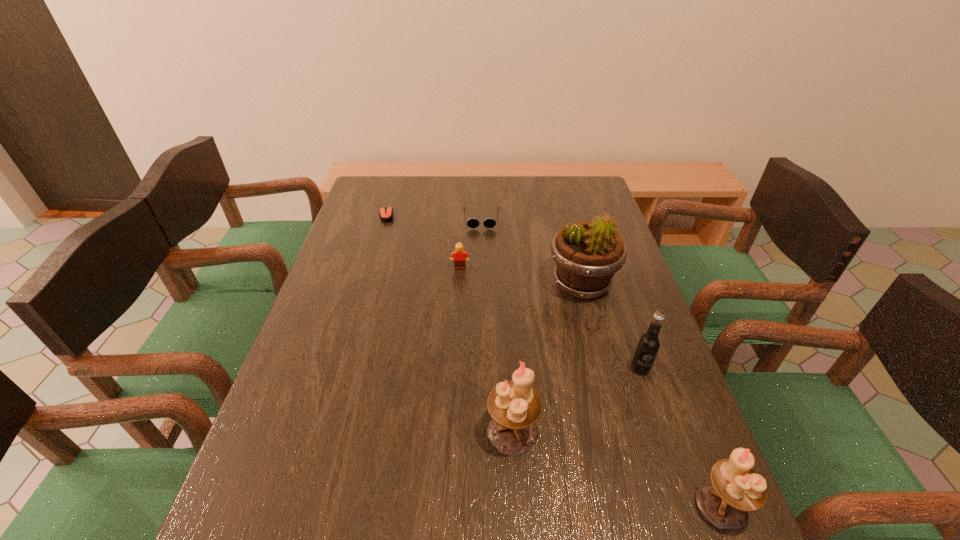
I want to click on vacant region between the sixth tallest object and the taller candle holder, so click(x=497, y=325).

Identify the location of empty space between the fifth farthest object and the computer mouse. (514, 292).

This screenshot has height=540, width=960. In order to click on empty space that is in between the fifth farthest object and the nearer candle holder in this screenshot , I will do [681, 437].

Find the location of a particular element. unoccupied position between the second nearest object and the computer mouse is located at coordinates (449, 324).

The height and width of the screenshot is (540, 960). I want to click on object that ranks as the fifth closest to the flowerpot, so click(x=735, y=488).

Locate an element on the screen. This screenshot has height=540, width=960. object that is the sixth closest one to the fifth farthest object is located at coordinates (386, 213).

This screenshot has height=540, width=960. What are the coordinates of `free location that satisfies the following two spatial constraints: 1. on the face of the Lego; 2. on the left side of the flowerpot` in the screenshot? It's located at (459, 284).

You are a GUI agent. You are given a task and a screenshot of the screen. Output one action in this format:
    pyautogui.click(x=<x>, y=<y>)
    Task: Click on the vacant position in the image that satisfies the following two spatial constraints: 1. on the front side of the flowerpot; 2. on the right side of the shortest object
    
    Given the screenshot: What is the action you would take?
    pyautogui.click(x=367, y=284)

This screenshot has width=960, height=540. I want to click on vacant point that satisfies the following two spatial constraints: 1. on the front side of the right candle holder; 2. on the left side of the flowerpot, so click(x=639, y=505).

The width and height of the screenshot is (960, 540). Find the location of `vacant space that satisfies the following two spatial constraints: 1. on the front-facing side of the sixth tallest object; 2. on the right side of the right candle holder`. vacant space that satisfies the following two spatial constraints: 1. on the front-facing side of the sixth tallest object; 2. on the right side of the right candle holder is located at coordinates (483, 505).